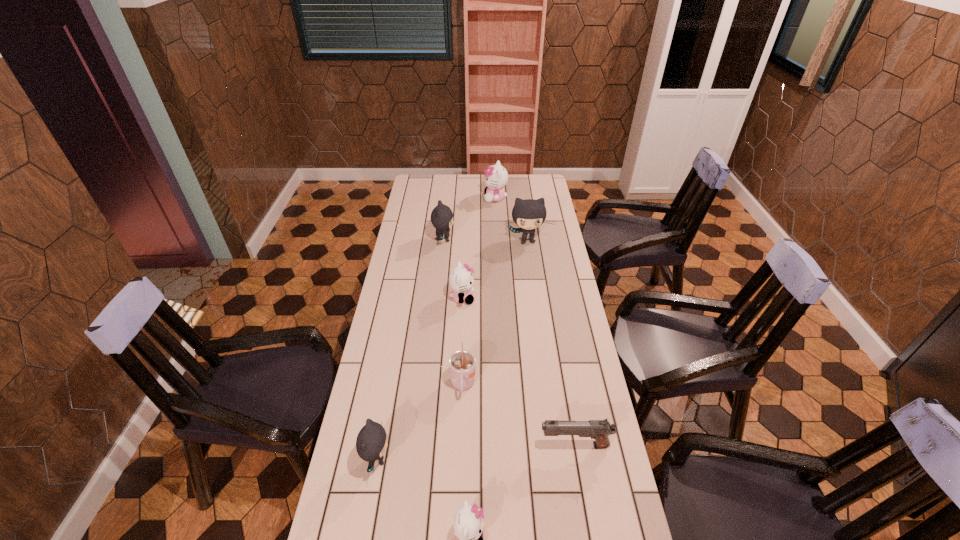
Find the location of a particular element. free location located on the front-facing side of the biggest gray kitten is located at coordinates (537, 309).

The image size is (960, 540). Find the location of `free space located on the front-facing side of the farthest object`. free space located on the front-facing side of the farthest object is located at coordinates (416, 198).

The height and width of the screenshot is (540, 960). What are the coordinates of `free region located 0.110m on the front-facing side of the farthest object` in the screenshot? It's located at click(463, 198).

Locate an element on the screen. The width and height of the screenshot is (960, 540). vacant region located on the front-facing side of the farthest object is located at coordinates (421, 198).

The height and width of the screenshot is (540, 960). What are the coordinates of `vacant space located 0.080m on the front-facing side of the second smallest gray kitten` in the screenshot? It's located at (471, 240).

Identify the location of blank space located on the front-facing side of the second biggest white kitten. Image resolution: width=960 pixels, height=540 pixels. (545, 298).

Identify the location of free space located on the front-facing side of the leftmost object. (437, 460).

Where is `vacant space situated on the side with the handle of the fourth nearest object`? The width and height of the screenshot is (960, 540). vacant space situated on the side with the handle of the fourth nearest object is located at coordinates (458, 520).

Image resolution: width=960 pixels, height=540 pixels. Identify the location of free space located in the direction the gun is aimed. (437, 446).

At what (x,y) coordinates should I click in order to perform the action: click on vacant space located in the direction the gun is aimed. Please return your answer as a coordinate pair (x, y). The height and width of the screenshot is (540, 960). Looking at the image, I should click on (474, 446).